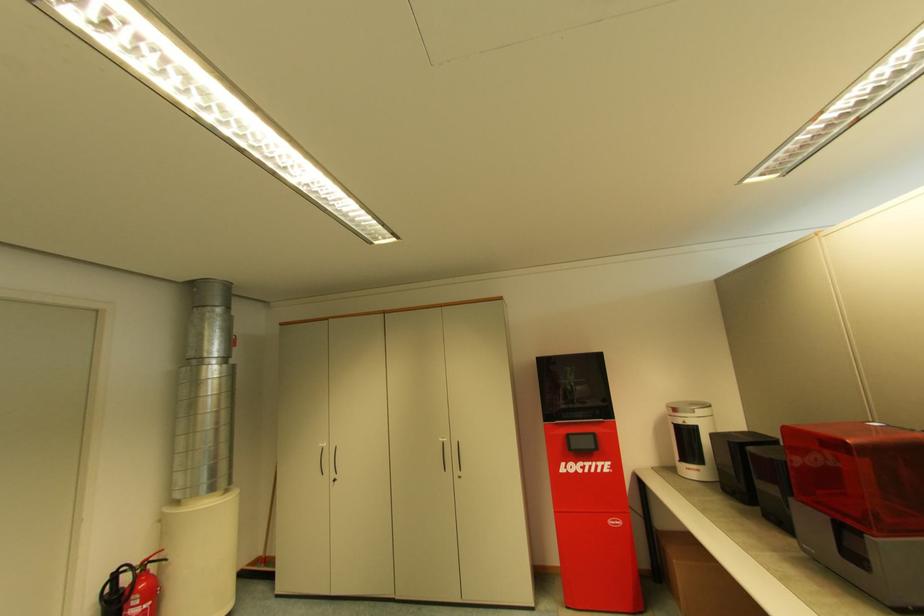
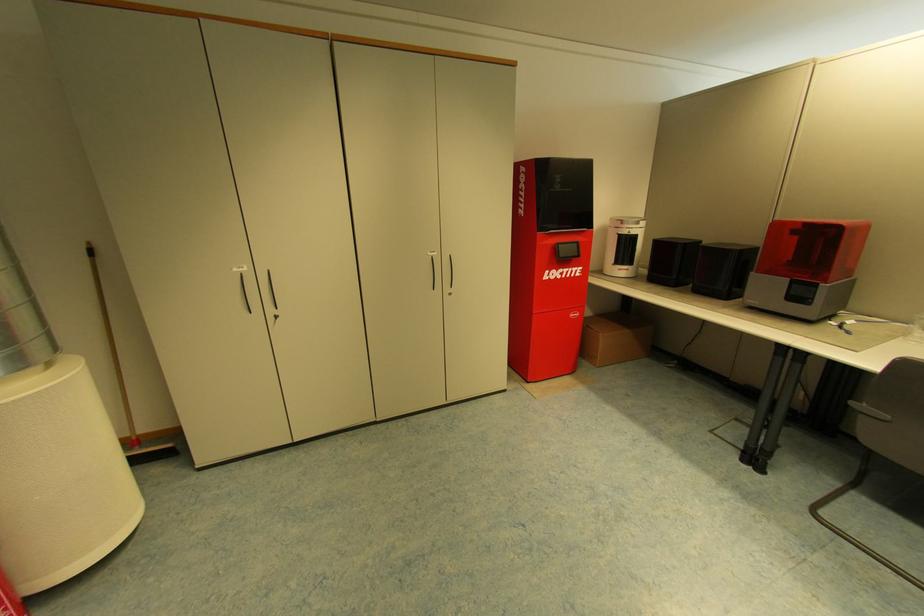
Where in the second image is the point corresponding to [446,440] from the first image?

(436, 254)